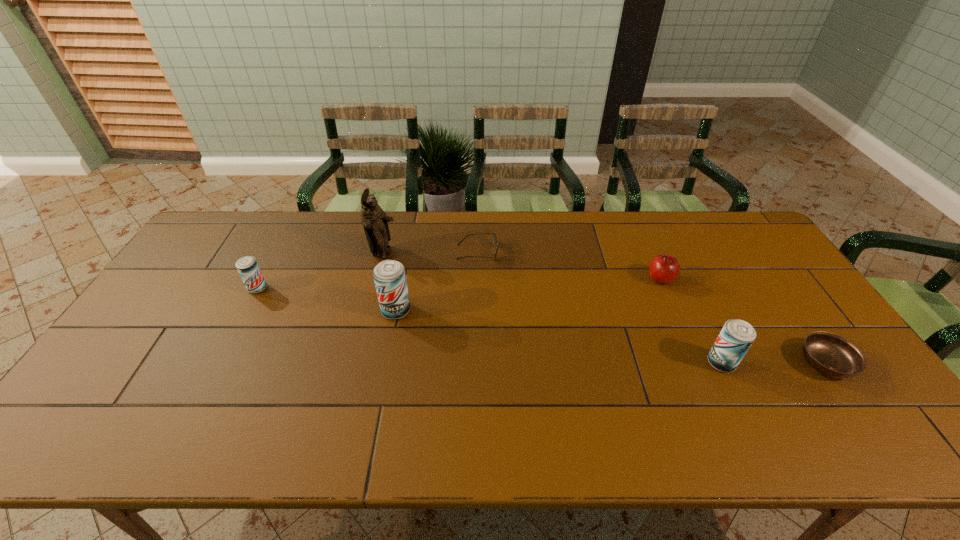
The height and width of the screenshot is (540, 960). In order to click on vacant space in between the rightmost object and the figurine in this screenshot , I will do `click(605, 308)`.

This screenshot has width=960, height=540. Find the location of `free space between the third nearest object and the rightmost object`. free space between the third nearest object and the rightmost object is located at coordinates (611, 336).

What are the coordinates of `free space between the soup bowl and the rightmost beer can` in the screenshot? It's located at (774, 363).

Identify the location of unoccupied area between the figurine and the shortest beer can. tap(321, 271).

The height and width of the screenshot is (540, 960). I want to click on free spot between the fifth shortest object and the figurine, so click(553, 308).

I want to click on free spot between the sixth shortest object and the fourth object from left to right, so click(x=437, y=281).

Identify which object is the nearest to the soup bowl. Please provide its 2D coordinates. Your answer should be formatted as a tuple, i.e. [(x, y)], where the tuple contains the x and y coordinates of a point satisfying the conditions above.

[(736, 337)]

Locate an element on the screen. object that can be found as the third closest to the figurine is located at coordinates (247, 266).

Locate which beer can ranks in proximity to the leftmost beer can. Please provide its 2D coordinates. Your answer should be formatted as a tuple, i.e. [(x, y)], where the tuple contains the x and y coordinates of a point satisfying the conditions above.

[(389, 276)]

Locate which beer can ranks in proximity to the nearest beer can. Please provide its 2D coordinates. Your answer should be formatted as a tuple, i.e. [(x, y)], where the tuple contains the x and y coordinates of a point satisfying the conditions above.

[(389, 276)]